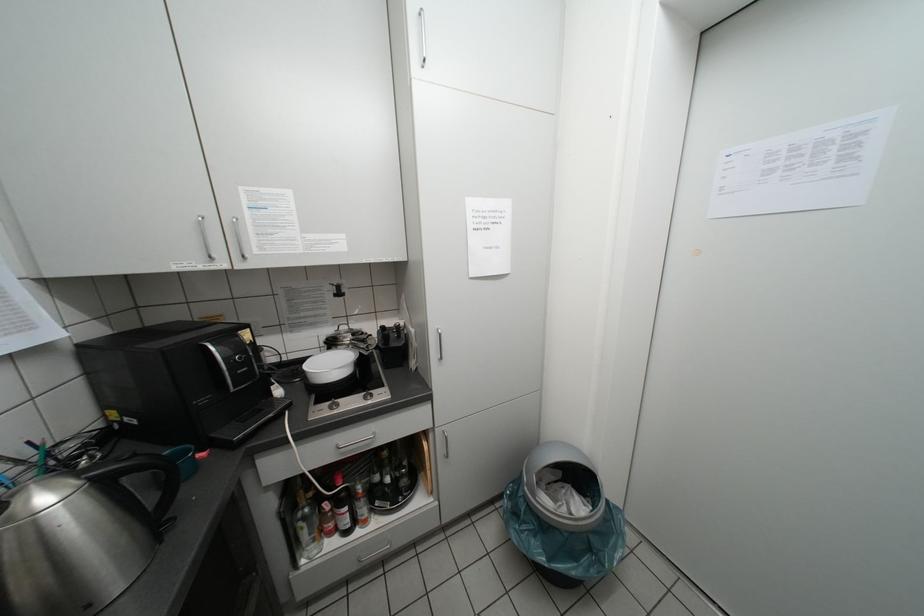
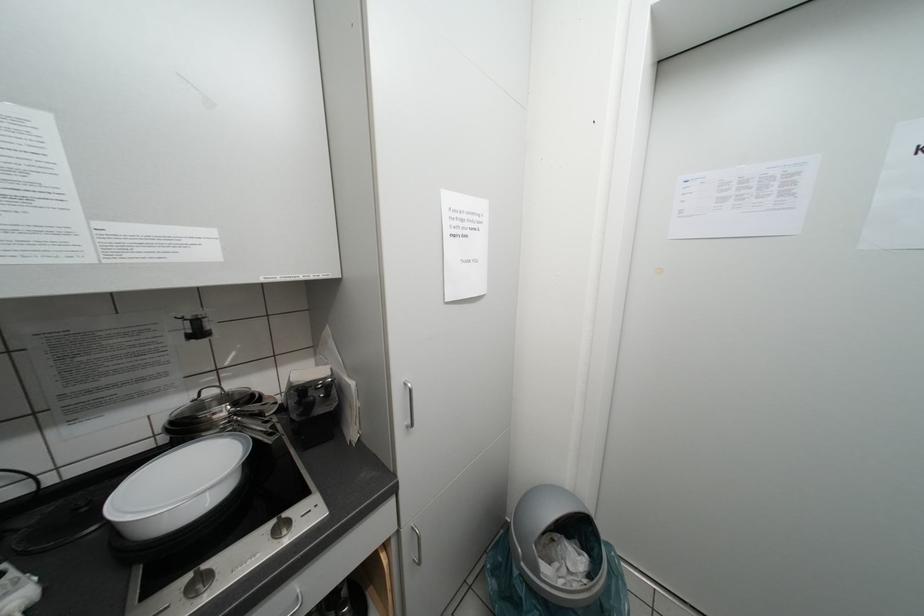
Question: Based on the continuous images, in which direction is the camera rotating? Reply with the corresponding letter.

Choices:
 (A) Left
 (B) Right
 (C) Up
 (D) Down

Answer: (B)